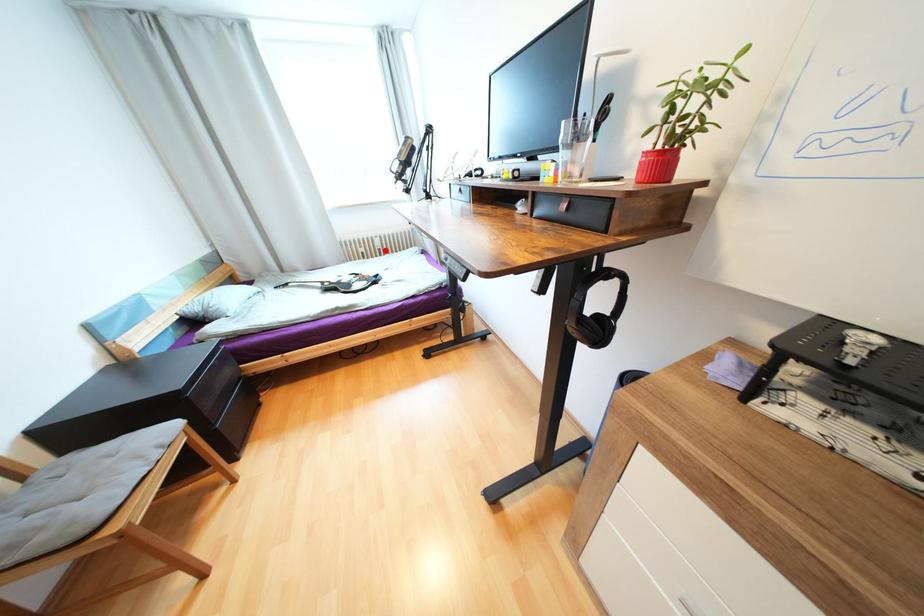
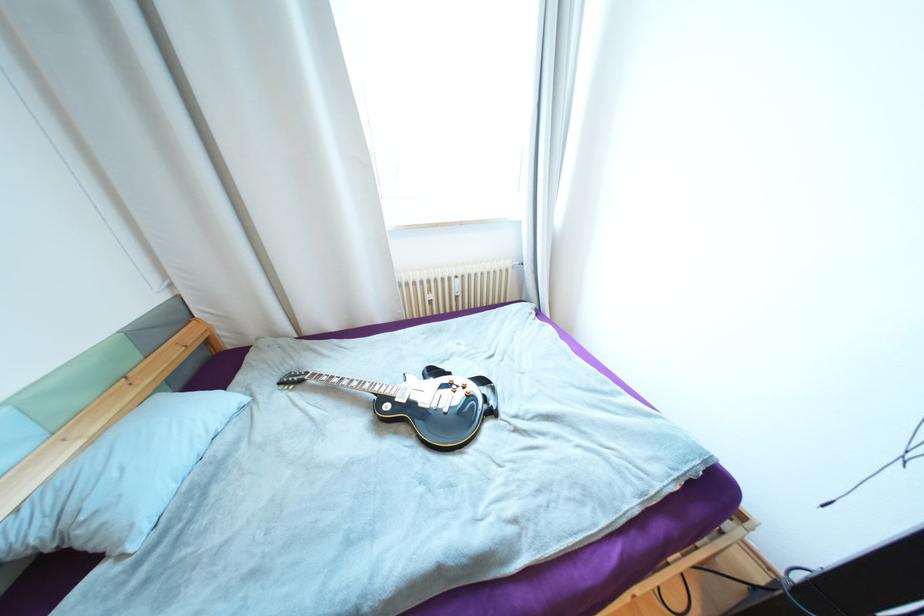
In the second image, find the point that corresponds to the highlighted location in the first image.

(463, 297)